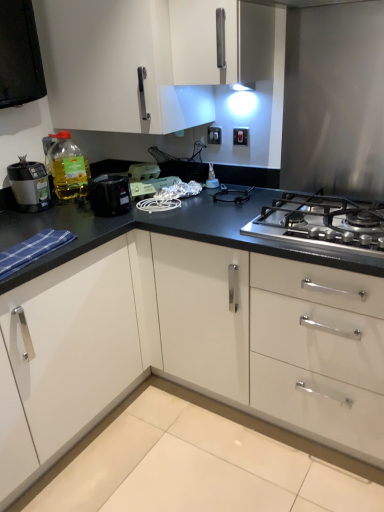
Question: In terms of height, does translucent yellow bottle at left look taller or shorter compared to white plastic electric outlet at upper center, which ranks as the 1th electric outlet in back-to-front order?

Choices:
 (A) short
 (B) tall

Answer: (B)

Question: Considering the positions of point (66, 194) and point (216, 131), is point (66, 194) closer or farther from the camera than point (216, 131)?

Choices:
 (A) farther
 (B) closer

Answer: (B)

Question: Which is nearer to the translucent yellow bottle at left?

Choices:
 (A) stainless steel gas stove at center
 (B) matte black blender at left, the 1th kitchen appliance in the left-to-right sequence
 (C) white plastic electric outlet at upper center, which is the first electric outlet from front to back
 (D) white glossy cabinet at upper center
 (E) matte black toaster at center, the first kitchen appliance positioned from the right

Answer: (B)

Question: Based on their relative distances, which object is farther from the matte black blender at left, acting as the second kitchen appliance starting from the right?

Choices:
 (A) stainless steel gas stove at center
 (B) white plastic electric outlet at upper center, marked as the second electric outlet in a left-to-right arrangement
 (C) white glossy cabinet at upper center
 (D) matte black toaster at center, which is the second kitchen appliance in left-to-right order
 (E) translucent yellow bottle at left

Answer: (A)